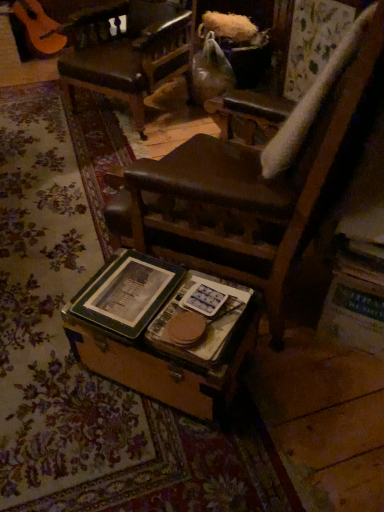
What is the approximate width of hardcover book at center, marked as the 2th paperback book in a left-to-right arrangement?

hardcover book at center, marked as the 2th paperback book in a left-to-right arrangement, is 8.80 inches in width.

This screenshot has height=512, width=384. What do you see at coordinates (160, 334) in the screenshot?
I see `wooden trunk at center` at bounding box center [160, 334].

Describe the element at coordinates (132, 64) in the screenshot. I see `leather seat at center` at that location.

How much space does green matte book at center, acting as the 1th paperback book starting from the left, occupy horizontally?

The width of green matte book at center, acting as the 1th paperback book starting from the left, is 9.81 inches.

Describe the element at coordinates (127, 294) in the screenshot. I see `green matte book at center, acting as the 1th paperback book starting from the left` at that location.

The height and width of the screenshot is (512, 384). What are the coordinates of `hardcover book at center, marked as the 2th paperback book in a left-to-right arrangement` in the screenshot? It's located at (205, 322).

Is wooden trunk at center outside of green matte book at center, arranged as the 2th paperback book when viewed from the right?

Yes, wooden trunk at center is located beyond the bounds of green matte book at center, arranged as the 2th paperback book when viewed from the right.

Can you confirm if wooden trunk at center is taller than green matte book at center, arranged as the 2th paperback book when viewed from the right?

Correct, wooden trunk at center is much taller as green matte book at center, arranged as the 2th paperback book when viewed from the right.

How different are the orientations of wooden trunk at center and green matte book at center, arranged as the 2th paperback book when viewed from the right, in degrees?

The facing directions of wooden trunk at center and green matte book at center, arranged as the 2th paperback book when viewed from the right, are 1.54 degrees apart.

Identify the location of chair located above the wooden trunk at center (from the image's perspective). (132, 64).

Considering the sizes of objects wooden trunk at center and leather seat at center in the image provided, who is shorter, wooden trunk at center or leather seat at center?

wooden trunk at center.

From the image's perspective, is wooden trunk at center positioned above or below leather seat at center?

Clearly, from the image's perspective, wooden trunk at center is below leather seat at center.

Based on the photo, between wooden trunk at center and leather seat at center, which one appears on the right side from the viewer's perspective?

From the viewer's perspective, wooden trunk at center appears more on the right side.

Which is in front, green matte book at center, arranged as the 2th paperback book when viewed from the right, or leather seat at center?

Positioned in front is green matte book at center, arranged as the 2th paperback book when viewed from the right.

Is green matte book at center, arranged as the 2th paperback book when viewed from the right, thinner than leather seat at center?

Yes.

Does green matte book at center, arranged as the 2th paperback book when viewed from the right, turn towards leather seat at center?

No.

Does green matte book at center, arranged as the 2th paperback book when viewed from the right, have a greater width compared to wooden trunk at center?

No, green matte book at center, arranged as the 2th paperback book when viewed from the right, is not wider than wooden trunk at center.

Relative to wooden trunk at center, is green matte book at center, arranged as the 2th paperback book when viewed from the right, in front or behind?

green matte book at center, arranged as the 2th paperback book when viewed from the right, is behind wooden trunk at center.

Considering the relative sizes of green matte book at center, acting as the 1th paperback book starting from the left, and wooden trunk at center in the image provided, is green matte book at center, acting as the 1th paperback book starting from the left, taller than wooden trunk at center?

Incorrect, the height of green matte book at center, acting as the 1th paperback book starting from the left, is not larger of that of wooden trunk at center.

You are a GUI agent. You are given a task and a screenshot of the screen. Output one action in this format:
    pyautogui.click(x=<x>, y=<y>)
    Task: Click on the paperback book behind the hardcover book at center, the first paperback book viewed from the right
    
    Given the screenshot: What is the action you would take?
    point(127,294)

Can you confirm if green matte book at center, arranged as the 2th paperback book when viewed from the right, is taller than hardcover book at center, the first paperback book viewed from the right?

Yes.

In terms of size, does green matte book at center, acting as the 1th paperback book starting from the left, appear bigger or smaller than hardcover book at center, the first paperback book viewed from the right?

Clearly, green matte book at center, acting as the 1th paperback book starting from the left, is larger in size than hardcover book at center, the first paperback book viewed from the right.

Is the position of hardcover book at center, the first paperback book viewed from the right, less distant than that of green matte book at center, arranged as the 2th paperback book when viewed from the right?

Yes, hardcover book at center, the first paperback book viewed from the right, is in front of green matte book at center, arranged as the 2th paperback book when viewed from the right.

From the image's perspective, who appears lower, hardcover book at center, marked as the 2th paperback book in a left-to-right arrangement, or green matte book at center, acting as the 1th paperback book starting from the left?

hardcover book at center, marked as the 2th paperback book in a left-to-right arrangement, from the image's perspective.

Is there a large distance between hardcover book at center, marked as the 2th paperback book in a left-to-right arrangement, and green matte book at center, arranged as the 2th paperback book when viewed from the right?

No, there isn't a large distance between hardcover book at center, marked as the 2th paperback book in a left-to-right arrangement, and green matte book at center, arranged as the 2th paperback book when viewed from the right.

Which of these two, hardcover book at center, the first paperback book viewed from the right, or wooden trunk at center, is smaller?

Smaller between the two is hardcover book at center, the first paperback book viewed from the right.

From a real-world perspective, is hardcover book at center, the first paperback book viewed from the right, below wooden trunk at center?

No, from a real-world perspective, hardcover book at center, the first paperback book viewed from the right, is not under wooden trunk at center.

Where is `the 1st paperback book behind the wooden trunk at center, starting your count from the anchor`? the 1st paperback book behind the wooden trunk at center, starting your count from the anchor is located at coordinates (205, 322).

Locate an element on the screen. table below the green matte book at center, acting as the 1th paperback book starting from the left (from the image's perspective) is located at coordinates (160, 334).

Locate an element on the screen. The image size is (384, 512). table to the right of leather seat at center is located at coordinates (160, 334).

From the image, which object appears to be farther from leather seat at center, hardcover book at center, the first paperback book viewed from the right, or green matte book at center, arranged as the 2th paperback book when viewed from the right?

hardcover book at center, the first paperback book viewed from the right, is further to leather seat at center.

Which object lies nearer to the anchor point green matte book at center, acting as the 1th paperback book starting from the left, wooden trunk at center or hardcover book at center, the first paperback book viewed from the right?

wooden trunk at center is closer to green matte book at center, acting as the 1th paperback book starting from the left.

Looking at the image, which one is located closer to hardcover book at center, the first paperback book viewed from the right, wooden trunk at center or leather seat at center?

wooden trunk at center.

Based on the photo, based on their spatial positions, is green matte book at center, arranged as the 2th paperback book when viewed from the right, or leather seat at center further from hardcover book at center, the first paperback book viewed from the right?

leather seat at center.

Looking at the image, which one is located further to leather seat at center, green matte book at center, arranged as the 2th paperback book when viewed from the right, or wooden trunk at center?

green matte book at center, arranged as the 2th paperback book when viewed from the right, is further to leather seat at center.

Estimate the real-world distances between objects in this image. Which object is closer to green matte book at center, acting as the 1th paperback book starting from the left, leather seat at center or hardcover book at center, marked as the 2th paperback book in a left-to-right arrangement?

The object closer to green matte book at center, acting as the 1th paperback book starting from the left, is hardcover book at center, marked as the 2th paperback book in a left-to-right arrangement.

When comparing their distances from wooden trunk at center, does leather seat at center or green matte book at center, acting as the 1th paperback book starting from the left, seem closer?

green matte book at center, acting as the 1th paperback book starting from the left, lies closer to wooden trunk at center than the other object.

Looking at the image, which one is located further to leather seat at center, wooden trunk at center or green matte book at center, arranged as the 2th paperback book when viewed from the right?

The object further to leather seat at center is green matte book at center, arranged as the 2th paperback book when viewed from the right.

Find the location of a particular element. paperback book between leather seat at center and hardcover book at center, the first paperback book viewed from the right, in the vertical direction is located at coordinates (127, 294).

This screenshot has height=512, width=384. Identify the location of table between green matte book at center, acting as the 1th paperback book starting from the left, and hardcover book at center, marked as the 2th paperback book in a left-to-right arrangement, in the horizontal direction. (160, 334).